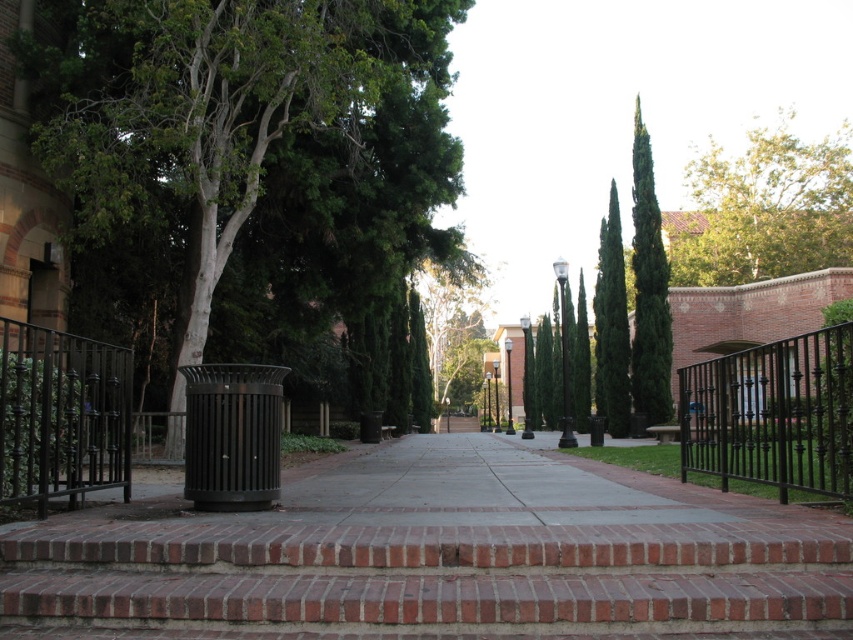
From the picture: Is black wrought iron fence at right to the right of black wrought iron fence at left from the viewer's perspective?

Yes, black wrought iron fence at right is to the right of black wrought iron fence at left.

Which of these two, black wrought iron fence at right or black wrought iron fence at left, stands shorter?

Standing shorter between the two is black wrought iron fence at left.

Identify the location of black wrought iron fence at right. (772, 413).

The height and width of the screenshot is (640, 853). I want to click on black wrought iron fence at right, so click(772, 413).

Can you confirm if green leafy tree at upper right is bigger than green leafy tree at center?

Yes.

Is green leafy tree at upper right to the left of green leafy tree at center from the viewer's perspective?

Incorrect, green leafy tree at upper right is not on the left side of green leafy tree at center.

In order to click on green leafy tree at upper right in this screenshot , I will do `click(764, 209)`.

Which is above, green leafy tree at left or black wrought iron fence at right?

green leafy tree at left

Does green leafy tree at left have a greater width compared to black wrought iron fence at right?

In fact, green leafy tree at left might be narrower than black wrought iron fence at right.

Identify the location of green leafy tree at left. The width and height of the screenshot is (853, 640). (250, 150).

Image resolution: width=853 pixels, height=640 pixels. I want to click on green leafy tree at left, so click(x=250, y=150).